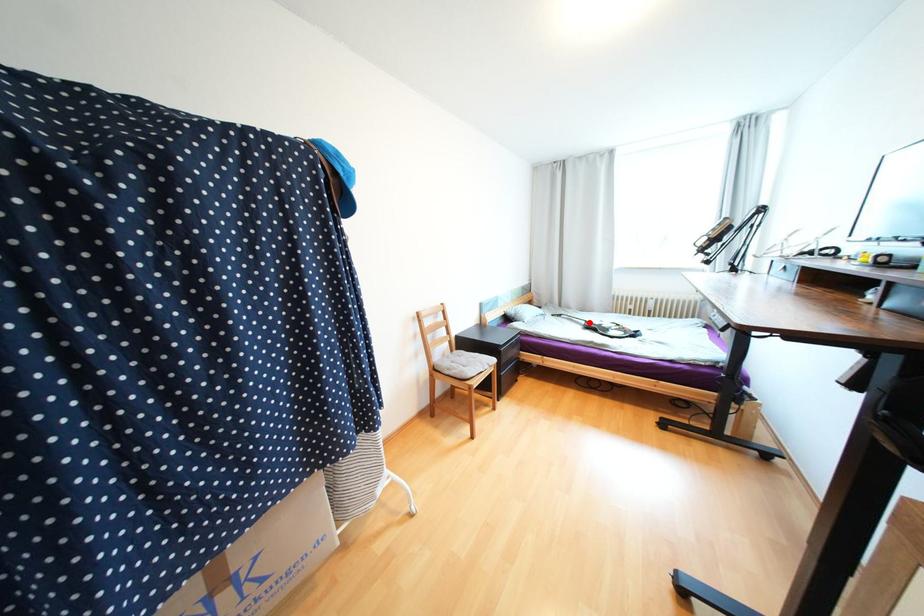
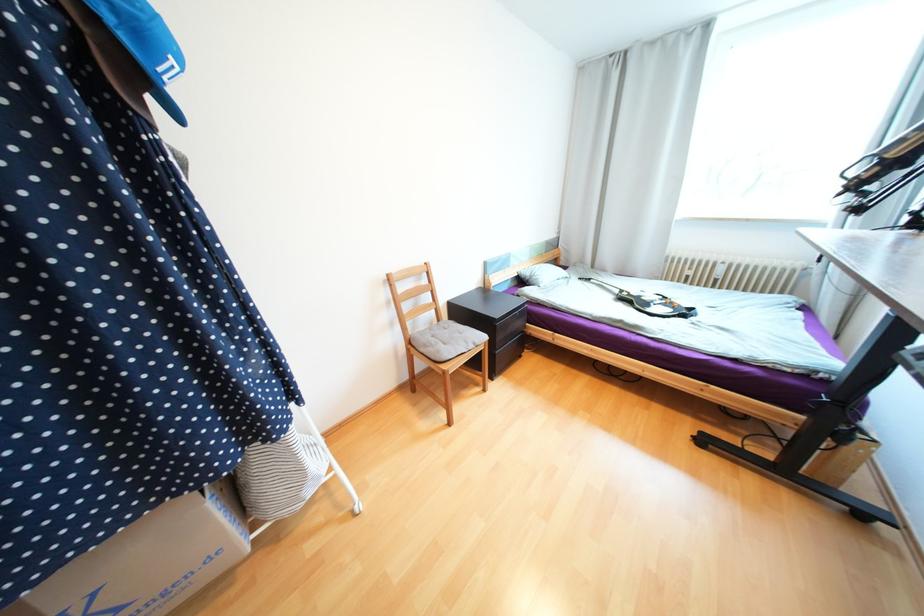
In the second image, find the point that corresponds to the highlighted location in the first image.

(623, 292)